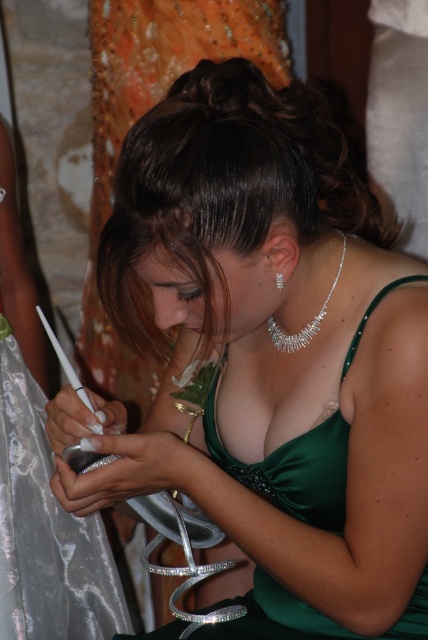
Question: Which of the following is the closest to the observer?

Choices:
 (A) silver metallic necklace at center
 (B) silver metallic dress at lower left

Answer: (A)

Question: Among these objects, which one is nearest to the camera?

Choices:
 (A) silver metallic necklace at center
 (B) silver metallic dress at lower left

Answer: (A)

Question: Is silver metallic dress at lower left positioned before silver metallic necklace at center?

Choices:
 (A) no
 (B) yes

Answer: (A)

Question: Which point is farther to the camera?

Choices:
 (A) silver metallic necklace at center
 (B) silver metallic dress at lower left

Answer: (B)

Question: Is silver metallic dress at lower left closer to camera compared to silver metallic necklace at center?

Choices:
 (A) yes
 (B) no

Answer: (B)

Question: Does silver metallic dress at lower left appear under silver metallic necklace at center?

Choices:
 (A) no
 (B) yes

Answer: (B)